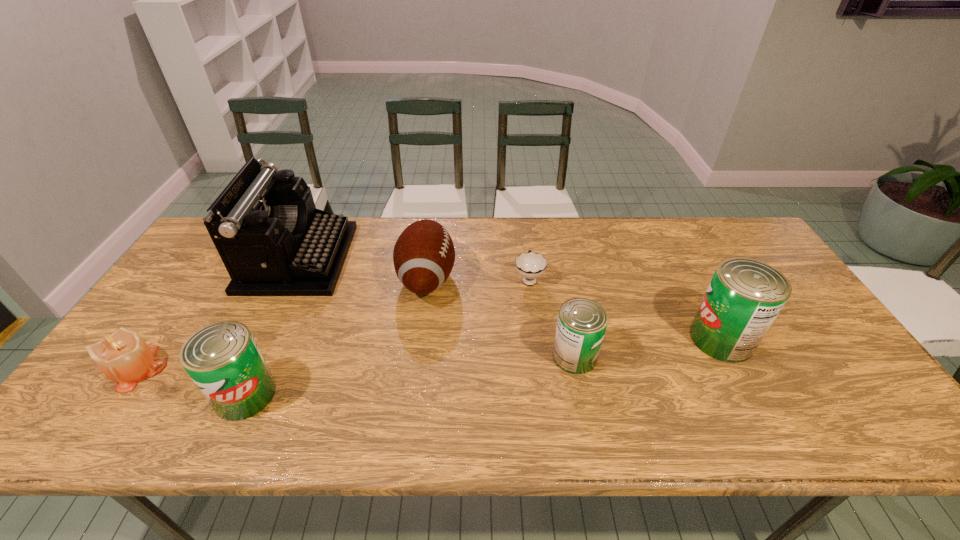
Locate an element on the screen. The width and height of the screenshot is (960, 540). the leftmost can is located at coordinates (223, 360).

Locate an element on the screen. This screenshot has height=540, width=960. the second can from left to right is located at coordinates (581, 325).

The width and height of the screenshot is (960, 540). Find the location of `the rightmost can`. the rightmost can is located at coordinates (745, 296).

You are a GUI agent. You are given a task and a screenshot of the screen. Output one action in this format:
    pyautogui.click(x=<x>, y=<y>)
    Task: Click on the shortest object
    
    Given the screenshot: What is the action you would take?
    pyautogui.click(x=530, y=266)

What are the coordinates of `the tallest object` in the screenshot? It's located at (273, 241).

This screenshot has width=960, height=540. Find the location of `the fourth object from right to left`. the fourth object from right to left is located at coordinates (424, 254).

Find the location of `the leftmost object`. the leftmost object is located at coordinates (123, 356).

Identify the location of free space located 0.130m on the back of the second shortest can. The height and width of the screenshot is (540, 960). (275, 330).

I want to click on free space located on the back of the shortest can, so click(554, 250).

Where is `vacant space located 0.370m on the left of the rightmost object`? This screenshot has height=540, width=960. vacant space located 0.370m on the left of the rightmost object is located at coordinates (549, 339).